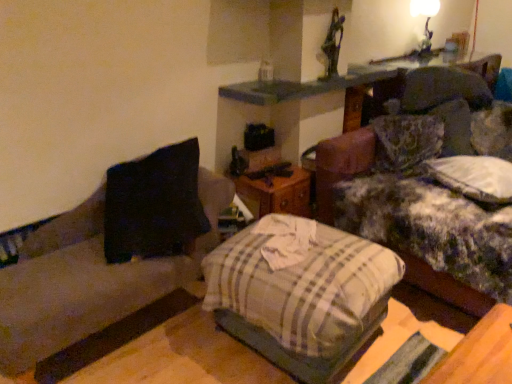
Question: Is white glossy lampshade at upper right oriented away from fluffy fabric couch at upper right?

Choices:
 (A) no
 (B) yes

Answer: (A)

Question: Is white glossy lampshade at upper right not inside fluffy fabric couch at upper right?

Choices:
 (A) no
 (B) yes

Answer: (B)

Question: Is white glossy lampshade at upper right closer to the viewer compared to fluffy fabric couch at upper right?

Choices:
 (A) no
 (B) yes

Answer: (A)

Question: Considering the relative sizes of white glossy lampshade at upper right and fluffy fabric couch at upper right in the image provided, is white glossy lampshade at upper right bigger than fluffy fabric couch at upper right?

Choices:
 (A) no
 (B) yes

Answer: (A)

Question: Is the surface of white glossy lampshade at upper right in direct contact with fluffy fabric couch at upper right?

Choices:
 (A) yes
 (B) no

Answer: (B)

Question: From a real-world perspective, is white glossy lampshade at upper right under fluffy fabric couch at upper right?

Choices:
 (A) no
 (B) yes

Answer: (A)

Question: Considering the relative positions of white glossy lampshade at upper right and plaid fabric pillow at center in the image provided, is white glossy lampshade at upper right to the left of plaid fabric pillow at center from the viewer's perspective?

Choices:
 (A) yes
 (B) no

Answer: (B)

Question: Does white glossy lampshade at upper right come behind plaid fabric pillow at center?

Choices:
 (A) yes
 (B) no

Answer: (A)

Question: From a real-world perspective, is white glossy lampshade at upper right below plaid fabric pillow at center?

Choices:
 (A) no
 (B) yes

Answer: (A)

Question: Considering the relative sizes of white glossy lampshade at upper right and plaid fabric pillow at center in the image provided, is white glossy lampshade at upper right wider than plaid fabric pillow at center?

Choices:
 (A) no
 (B) yes

Answer: (A)

Question: Considering the relative sizes of white glossy lampshade at upper right and plaid fabric pillow at center in the image provided, is white glossy lampshade at upper right smaller than plaid fabric pillow at center?

Choices:
 (A) no
 (B) yes

Answer: (B)

Question: From the image's perspective, would you say white glossy lampshade at upper right is shown under plaid fabric pillow at center?

Choices:
 (A) yes
 (B) no

Answer: (B)

Question: Is black fabric couch at left taller than plaid fabric pillow at center?

Choices:
 (A) no
 (B) yes

Answer: (B)